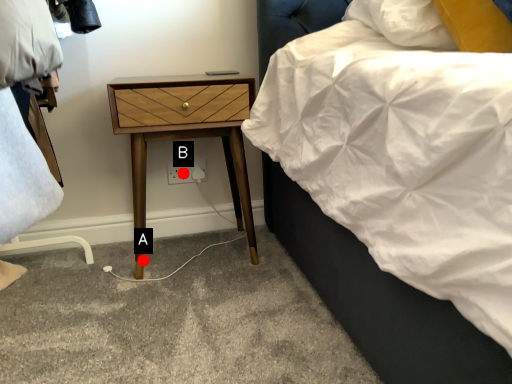
Question: Two points are circled on the image, labeled by A and B beside each circle. Which point is closer to the camera?

Choices:
 (A) A is closer
 (B) B is closer

Answer: (A)